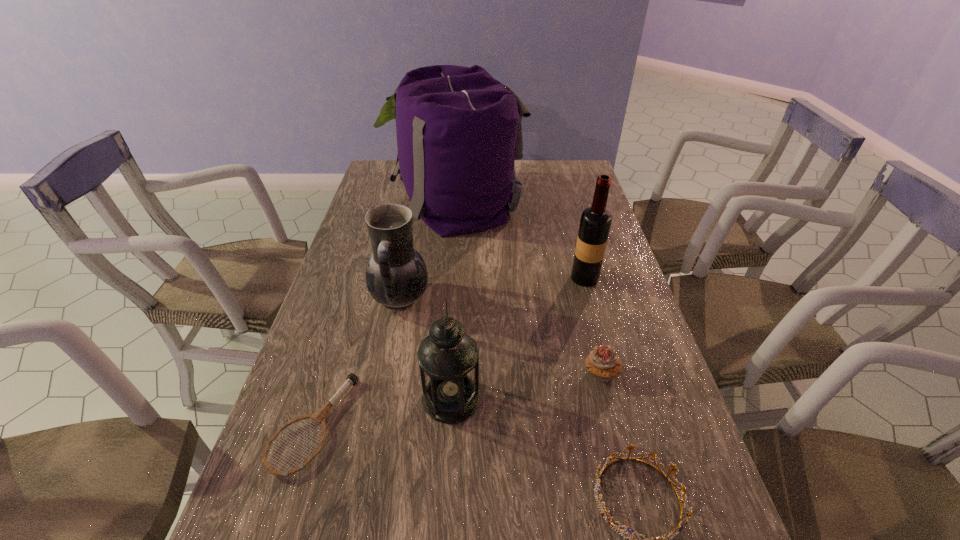
The height and width of the screenshot is (540, 960). Identify the location of backpack. (459, 131).

Identify the location of the tallest object. Image resolution: width=960 pixels, height=540 pixels. (459, 131).

At what (x,y) coordinates should I click in order to perform the action: click on wine bottle. Please return your answer as a coordinate pair (x, y). The height and width of the screenshot is (540, 960). Looking at the image, I should click on (595, 223).

Locate an element on the screen. The height and width of the screenshot is (540, 960). oil lamp is located at coordinates (448, 358).

You are a GUI agent. You are given a task and a screenshot of the screen. Output one action in this format:
    pyautogui.click(x=<x>, y=<y>)
    Task: Click on the pitcher
    This screenshot has height=540, width=960.
    Given the screenshot: What is the action you would take?
    pyautogui.click(x=396, y=275)

I want to click on the third shortest object, so click(602, 363).

Where is `the shortest object`? This screenshot has width=960, height=540. the shortest object is located at coordinates (319, 417).

Where is `vacant space situated on the front pocket of the farthest object`? vacant space situated on the front pocket of the farthest object is located at coordinates (558, 200).

Identify the location of blank space located on the front of the wine bottle. This screenshot has width=960, height=540. 615,393.

Locate an element on the screen. vacant space located 0.110m on the front of the oil lamp is located at coordinates (447, 475).